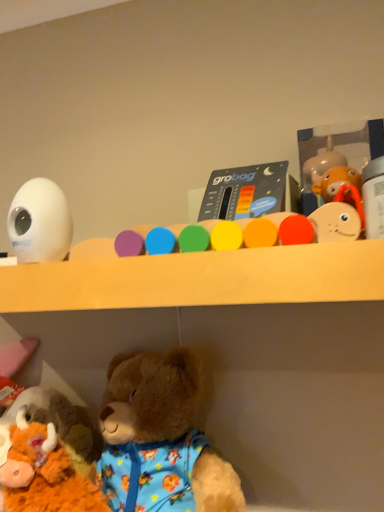
Question: Should I look upward or downward to see white plastic bottle at upper right, which is counted as the 3th toy, starting from the bottom?

Choices:
 (A) down
 (B) up

Answer: (B)

Question: Does fluffy brown teddy bear at lower left, the fourth toy when ordered from right to left, turn towards matte plastic thermometer at center, placed as the 4th toy when sorted from bottom to top?

Choices:
 (A) no
 (B) yes

Answer: (A)

Question: Does fluffy brown teddy bear at lower left, which is the 1th toy from left to right, come behind matte plastic thermometer at center, arranged as the 3th toy when viewed from the left?

Choices:
 (A) yes
 (B) no

Answer: (B)

Question: Is fluffy brown teddy bear at lower left, placed as the fourth toy when sorted from top to bottom, bigger than matte plastic thermometer at center, placed as the 2th toy when sorted from right to left?

Choices:
 (A) no
 (B) yes

Answer: (B)

Question: Is fluffy brown teddy bear at lower left, which is counted as the first toy, starting from the bottom, positioned far away from matte plastic thermometer at center, placed as the 2th toy when sorted from right to left?

Choices:
 (A) no
 (B) yes

Answer: (A)

Question: From the image's perspective, is fluffy brown teddy bear at lower left, the fourth toy when ordered from right to left, below matte plastic thermometer at center, arranged as the 3th toy when viewed from the left?

Choices:
 (A) yes
 (B) no

Answer: (A)

Question: Is fluffy brown teddy bear at lower left, placed as the fourth toy when sorted from top to bottom, to the right of matte plastic thermometer at center, placed as the 4th toy when sorted from bottom to top, from the viewer's perspective?

Choices:
 (A) no
 (B) yes

Answer: (A)

Question: Is the depth of white glossy egg at upper left, the third toy viewed from the top, less than that of white plastic bottle at upper right, which appears as the second toy when viewed from the top?

Choices:
 (A) yes
 (B) no

Answer: (B)

Question: Considering the relative sizes of white glossy egg at upper left, marked as the 3th toy in a right-to-left arrangement, and white plastic bottle at upper right, which appears as the first toy when viewed from the right, in the image provided, is white glossy egg at upper left, marked as the 3th toy in a right-to-left arrangement, shorter than white plastic bottle at upper right, which appears as the first toy when viewed from the right,?

Choices:
 (A) yes
 (B) no

Answer: (B)

Question: From the image's perspective, is white glossy egg at upper left, arranged as the 2th toy when ordered from the bottom, on white plastic bottle at upper right, positioned as the fourth toy in left-to-right order?

Choices:
 (A) yes
 (B) no

Answer: (B)

Question: From the image's perspective, is white glossy egg at upper left, the second toy positioned from the left, beneath white plastic bottle at upper right, which appears as the second toy when viewed from the top?

Choices:
 (A) yes
 (B) no

Answer: (A)

Question: Does white glossy egg at upper left, the third toy viewed from the top, come behind white plastic bottle at upper right, which appears as the first toy when viewed from the right?

Choices:
 (A) no
 (B) yes

Answer: (B)

Question: Considering the relative sizes of white glossy egg at upper left, arranged as the 2th toy when ordered from the bottom, and white plastic bottle at upper right, which is counted as the 3th toy, starting from the bottom, in the image provided, is white glossy egg at upper left, arranged as the 2th toy when ordered from the bottom, wider than white plastic bottle at upper right, which is counted as the 3th toy, starting from the bottom,?

Choices:
 (A) yes
 (B) no

Answer: (B)

Question: Could you tell me if white plastic bottle at upper right, which appears as the first toy when viewed from the right, is facing fluffy brown teddy bear at lower left, which is the 1th toy from left to right?

Choices:
 (A) yes
 (B) no

Answer: (B)